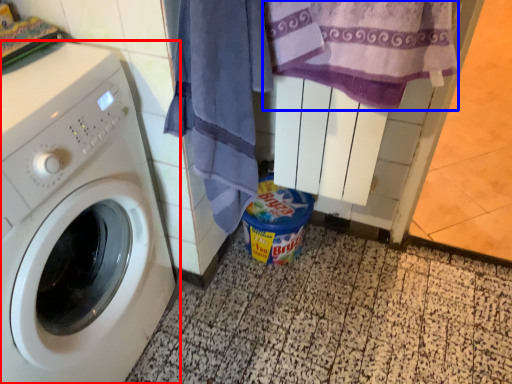
Question: Among these objects, which one is nearest to the camera, washing machine (highlighted by a red box) or beach towel (highlighted by a blue box)?

Choices:
 (A) washing machine
 (B) beach towel

Answer: (A)